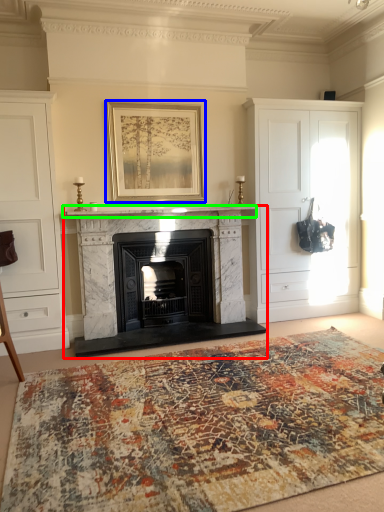
Question: Which is farther away from fireplace (highlighted by a red box)? picture frame (highlighted by a blue box) or mantle (highlighted by a green box)?

Choices:
 (A) picture frame
 (B) mantle

Answer: (A)